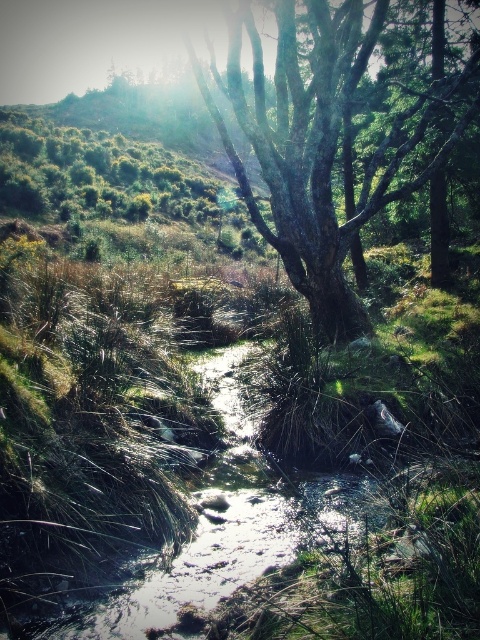
Between point (312, 148) and point (349, 490), which one is positioned in front?

Point (349, 490)

Can you confirm if smooth bark tree at center is shorter than clear water at stream center?

Incorrect, smooth bark tree at center's height does not fall short of clear water at stream center's.

Identify the location of smooth bark tree at center. (317, 144).